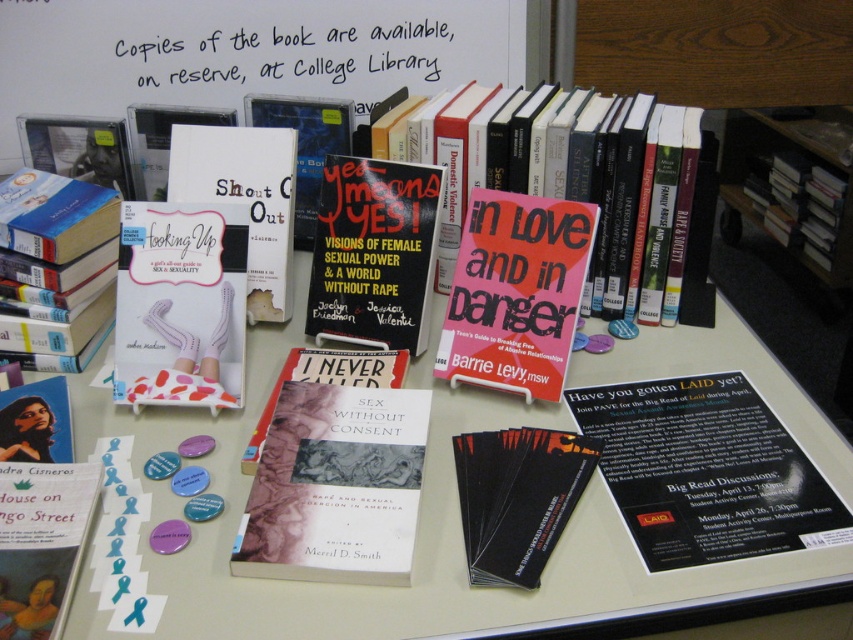
Consider the image. You are organizing a workshop on sexual health and need to place the hardcover book at lower left and the matte red book at center on a shelf. The shelf has limited space, and you want to arrange them side by side without overlapping. Which book should you place first to ensure they both fit?

The hardcover book at lower left is thinner than the matte red book at center. To ensure both fit side by side, place the thicker matte red book at center first, then the thinner hardcover book at lower left next to it.

You are a visitor at the library and want to pick up the white paper at upper center. The table is 3 feet away from you. Can you reach it without moving your chair?

The white paper at upper center is 3.63 feet away from the viewer, which is farther than the 3 feet distance of the table. Therefore, you cannot reach it without moving your chair.